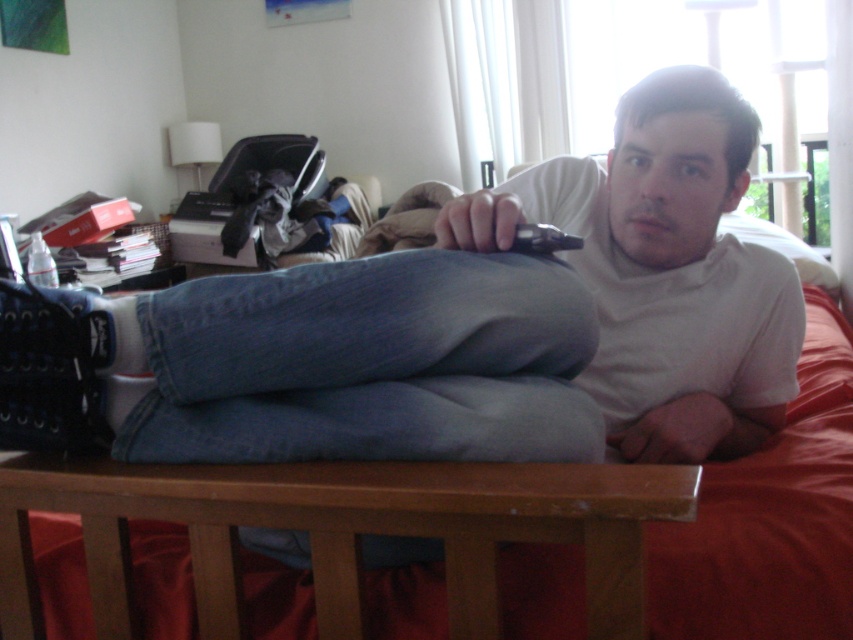
Looking at this image, you are a delivery robot trying to navigate to the printer near the wall in the image. You see the denim jeans at center and the black plastic remote at upper center. Which object is closer to the printer?

The denim jeans at center is taller than the black plastic remote at upper center, but their distances to the printer are not specified in the provided information. Therefore, I cannot determine which is closer based on the given details.

Looking at this image, you are a delivery person who needs to place a small package on the bed. The package is 10 cm tall. Can you place it on the denim bed at center without it being hidden by the denim jeans at center?

The denim jeans at center is much taller than the denim bed at center. Since the package is only 10 cm tall, it might still be visible if placed carefully, but there is a risk of it being obscured by the taller denim jeans at center.

From the picture: You need to place a small decorative item on the bed. Given the sizes of the denim bed at center and the black plastic remote at upper center, which object can definitely fit on the bed?

The black plastic remote at upper center can definitely fit on the denim bed at center because the denim bed at center is bigger than the black plastic remote at upper center.